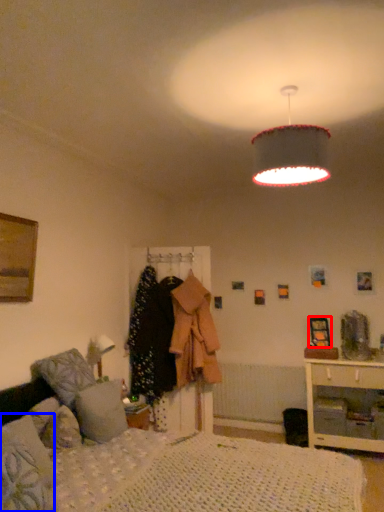
Question: Which point is closer to the camera, picture frame (highlighted by a red box) or pillow (highlighted by a blue box)?

Choices:
 (A) picture frame
 (B) pillow

Answer: (B)